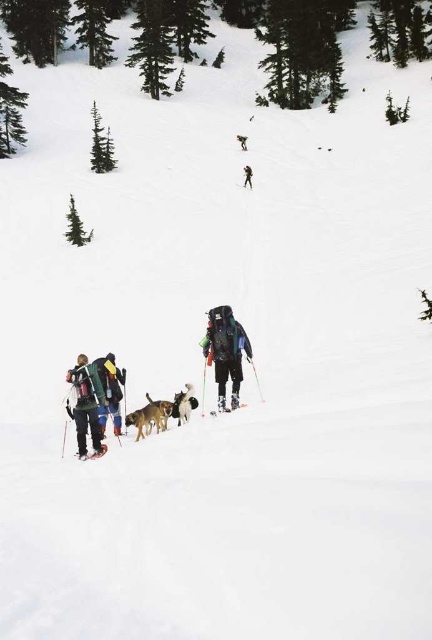
The height and width of the screenshot is (640, 432). What do you see at coordinates (110, 392) in the screenshot? I see `matte black backpack at lower left` at bounding box center [110, 392].

Which is more to the right, matte black backpack at lower left or shiny metallic ski at upper center?

From the viewer's perspective, shiny metallic ski at upper center appears more on the right side.

Who is more distant from viewer, (x=111, y=381) or (x=250, y=186)?

The point (x=250, y=186) is more distant.

Locate an element on the screen. The image size is (432, 640). matte black backpack at lower left is located at coordinates (110, 392).

Is brown fur dog at center wider than black ski suit at upper center?

Yes, brown fur dog at center is wider than black ski suit at upper center.

Between point (127, 422) and point (250, 182), which one is positioned behind?

The point (250, 182) is more distant.

Where is `brown fur dog at center`? The width and height of the screenshot is (432, 640). brown fur dog at center is located at coordinates [149, 417].

Can you confirm if matte black backpack at center is thinner than black ski suit at upper center?

No.

Can you confirm if matte black backpack at center is positioned below black ski suit at upper center?

Yes.

What do you see at coordinates (225, 352) in the screenshot? I see `matte black backpack at center` at bounding box center [225, 352].

Where is `matte black backpack at center`? The height and width of the screenshot is (640, 432). matte black backpack at center is located at coordinates (225, 352).